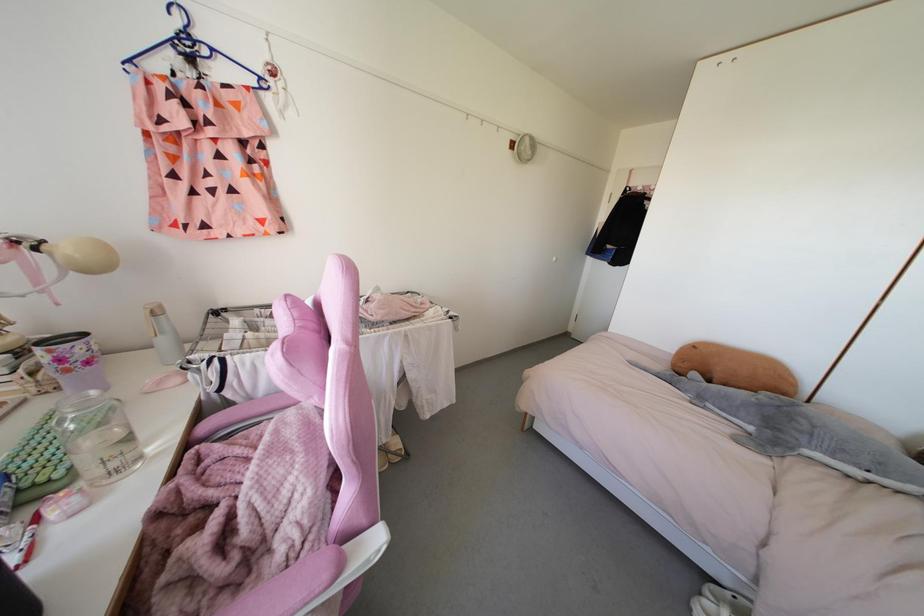
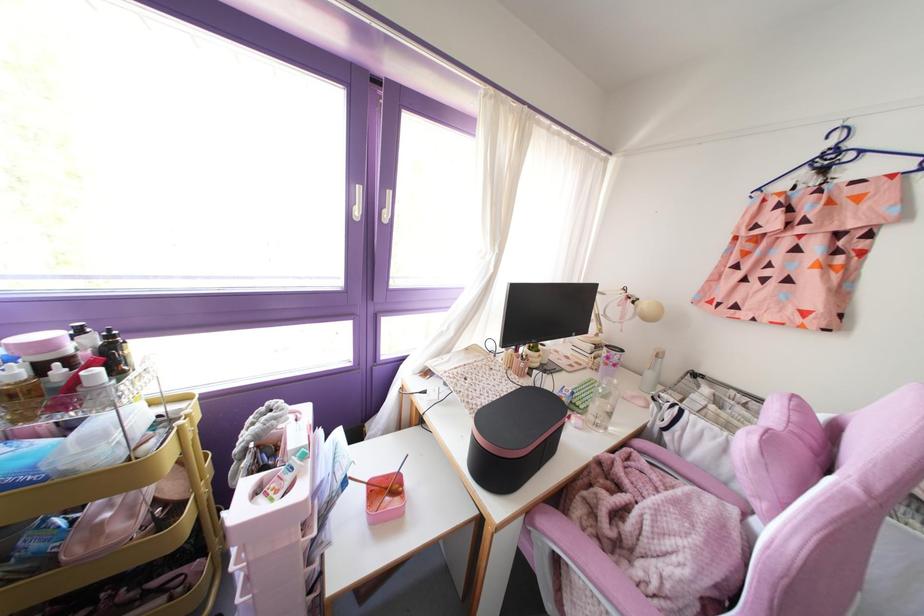
Where in the second image is the point corresponding to the point at 92,392 from the first image?

(614, 381)